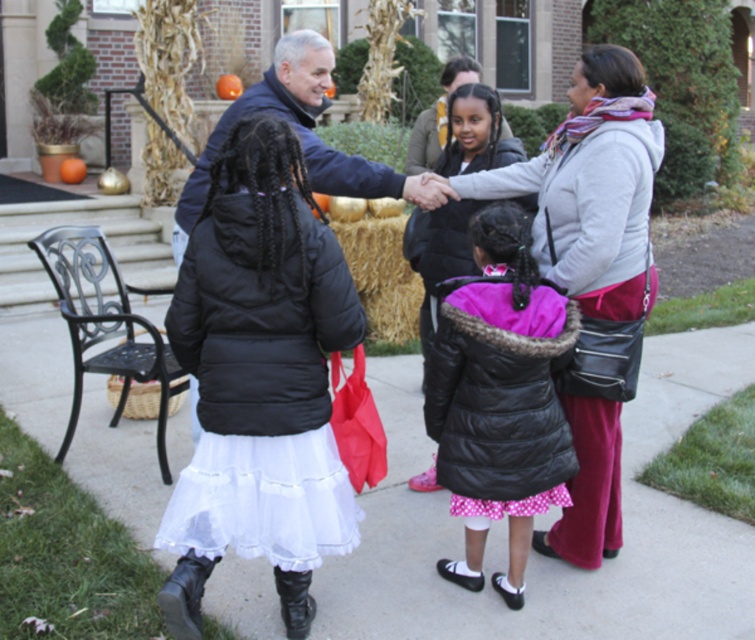
Consider the image. Can you confirm if black fur-trimmed coat at center is bigger than matte gray hoodie at center?

No, black fur-trimmed coat at center is not bigger than matte gray hoodie at center.

Measure the distance between point (464,432) and camera.

They are 3.05 meters apart.

The height and width of the screenshot is (640, 755). What do you see at coordinates (498, 396) in the screenshot?
I see `black fur-trimmed coat at center` at bounding box center [498, 396].

The image size is (755, 640). Find the location of `black fur-trimmed coat at center`. black fur-trimmed coat at center is located at coordinates (498, 396).

From the picture: Who is higher up, matte black jacket at center or haybrown at center?

haybrown at center is higher up.

Is matte black jacket at center to the left of haybrown at center from the viewer's perspective?

Incorrect, matte black jacket at center is not on the left side of haybrown at center.

Which is in front, point (451, 145) or point (399, 291)?

Point (451, 145) is in front.

You are a GUI agent. You are given a task and a screenshot of the screen. Output one action in this format:
    pyautogui.click(x=<x>, y=<y>)
    Task: Click on the matte black jacket at center
    The width and height of the screenshot is (755, 640).
    Given the screenshot: What is the action you would take?
    587,188

Who is shorter, white matte pavement at lower center or haybrown at center?

Standing shorter between the two is white matte pavement at lower center.

Does white matte pavement at lower center appear on the left side of haybrown at center?

Incorrect, white matte pavement at lower center is not on the left side of haybrown at center.

Does point (344, 561) come farther from viewer compared to point (378, 220)?

No.

At what (x,y) coordinates should I click in order to perform the action: click on white matte pavement at lower center. Please return your answer as a coordinate pair (x, y). This screenshot has width=755, height=640. Looking at the image, I should click on (547, 557).